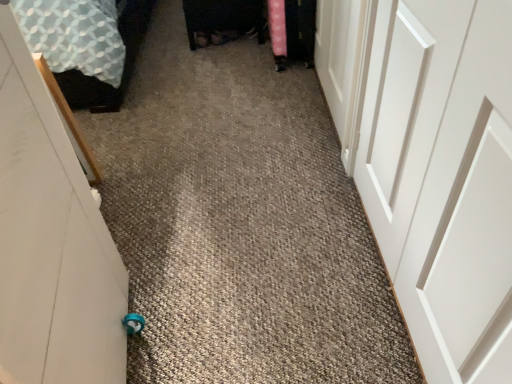
Find the location of a particular element. The image size is (512, 384). free space to the back side of white matte door at left, marked as the 3th door in a right-to-left arrangement is located at coordinates (182, 258).